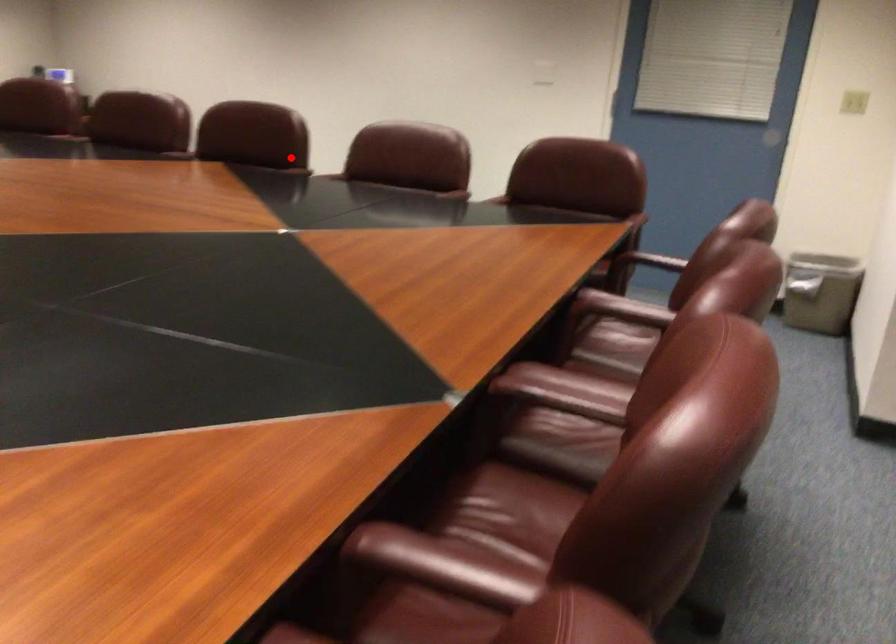
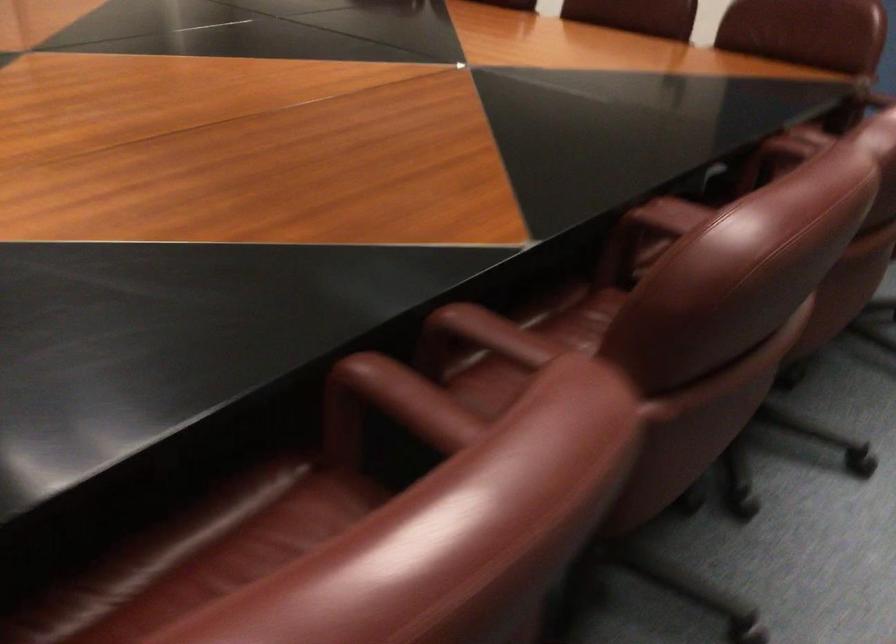
Locate, in the second image, the point that corresponds to the highlighted location in the first image.

(528, 344)